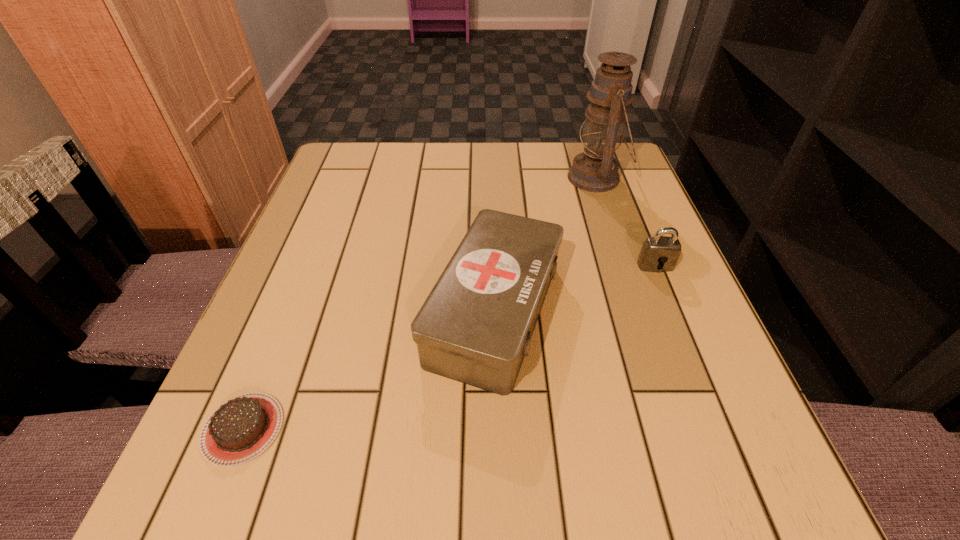
Select which object appears as the third closest to the farthest object. Please provide its 2D coordinates. Your answer should be formatted as a tuple, i.e. [(x, y)], where the tuple contains the x and y coordinates of a point satisfying the conditions above.

[(239, 430)]

In order to click on vacant point that satisfies the following two spatial constraints: 1. on the back side of the oil lamp; 2. on the left side of the first-aid kit in this screenshot , I will do `click(491, 178)`.